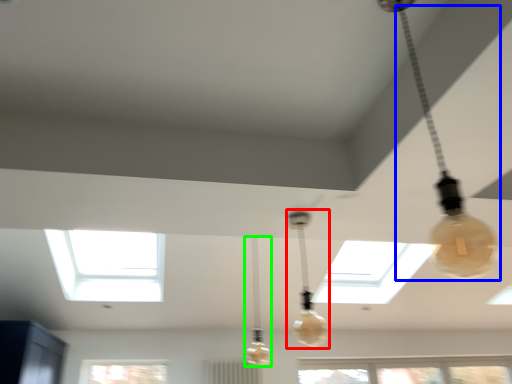
Question: Considering the real-world distances, which object is closest to lamp (highlighted by a red box)? lamp (highlighted by a blue box) or lamp (highlighted by a green box).

Choices:
 (A) lamp
 (B) lamp

Answer: (B)